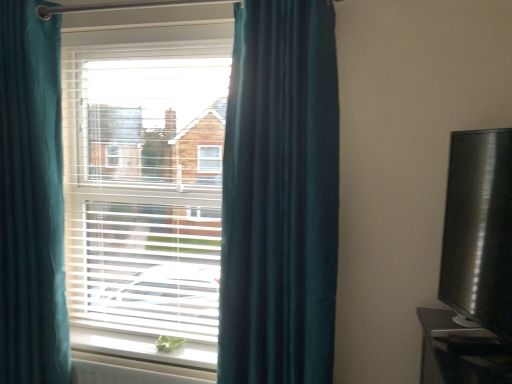
Describe the element at coordinates (143, 348) in the screenshot. I see `white matte window sill at lower center` at that location.

Measure the distance between point (249, 99) and camera.

Point (249, 99) is 4.84 feet from camera.

Locate an element on the screen. white plastic radiator at lower center is located at coordinates (133, 372).

The image size is (512, 384). In order to click on white plastic blinds at center in this screenshot , I will do `click(145, 190)`.

In order to click on white matte window sill at lower center in this screenshot , I will do `click(143, 348)`.

From a real-world perspective, between teal fabric curtain at left, the second curtain from the right, and white plastic radiator at lower center, who is vertically lower?

From a 3D spatial view, white plastic radiator at lower center is below.

From a real-world perspective, count 1st curtains upward from the white plastic radiator at lower center and point to it. Please provide its 2D coordinates.

[(31, 199)]

Are teal fabric curtain at left, acting as the 1th curtain starting from the left, and white plastic radiator at lower center located far from each other?

teal fabric curtain at left, acting as the 1th curtain starting from the left, is actually quite close to white plastic radiator at lower center.

At what (x,y) coordinates should I click in order to perform the action: click on bay window on the left of teal velvet curtain at left, which is the 2th curtain in left-to-right order. Please return your answer as a coordinate pair (x, y). The image size is (512, 384). Looking at the image, I should click on (145, 190).

Considering the sizes of objects teal velvet curtain at left, which is the 2th curtain in left-to-right order, and white plastic blinds at center in the image provided, who is wider, teal velvet curtain at left, which is the 2th curtain in left-to-right order, or white plastic blinds at center?

Wider between the two is teal velvet curtain at left, which is the 2th curtain in left-to-right order.

Relative to white plastic blinds at center, is teal velvet curtain at left, which is the 2th curtain in left-to-right order, in front or behind?

teal velvet curtain at left, which is the 2th curtain in left-to-right order, is in front of white plastic blinds at center.

Does white matte window sill at lower center have a larger size compared to teal velvet curtain at left, which is the 2th curtain in left-to-right order?

No.

In the image, there is a teal velvet curtain at left, which is the 2th curtain in left-to-right order. Identify the location of window sill below it (from the image's perspective). The width and height of the screenshot is (512, 384). (143, 348).

From the image's perspective, is white matte window sill at lower center below teal velvet curtain at left, the first curtain positioned from the right?

Yes.

From the picture: Can we say white matte window sill at lower center lies outside teal velvet curtain at left, which is the 2th curtain in left-to-right order?

Absolutely, white matte window sill at lower center is external to teal velvet curtain at left, which is the 2th curtain in left-to-right order.

How different are the orientations of white plastic radiator at lower center and white plastic blinds at center in degrees?

The facing directions of white plastic radiator at lower center and white plastic blinds at center are 0.00585 degrees apart.

Which object is more forward, white plastic radiator at lower center or white plastic blinds at center?

white plastic radiator at lower center is closer to the camera.

Is white plastic radiator at lower center with white plastic blinds at center?

white plastic radiator at lower center and white plastic blinds at center are clearly separated.

Between point (72, 365) and point (80, 157), which one is positioned behind?

The point (80, 157) is farther.

Between white plastic radiator at lower center and black glossy tv at right, which one has smaller width?

Thinner between the two is white plastic radiator at lower center.

Can you tell me how much white plastic radiator at lower center and black glossy tv at right differ in facing direction?

66.6 degrees separate the facing orientations of white plastic radiator at lower center and black glossy tv at right.

Does white plastic radiator at lower center turn towards black glossy tv at right?

No, white plastic radiator at lower center is not turned towards black glossy tv at right.

Which is closer to the camera, (74,373) or (509,162)?

Point (74,373) appears to be farther away from the viewer than point (509,162).

Looking at this image, is black glossy tv at right positioned with its back to white plastic blinds at center?

No, black glossy tv at right is not facing the opposite direction of white plastic blinds at center.

Between black glossy tv at right and white plastic blinds at center, which one has smaller size?

Smaller between the two is black glossy tv at right.

Is black glossy tv at right closer to camera compared to white plastic blinds at center?

Yes.

Is white plastic blinds at center at the back of teal fabric curtain at left, the second curtain from the right?

Correct, teal fabric curtain at left, the second curtain from the right, is looking away from white plastic blinds at center.

Can you confirm if teal fabric curtain at left, the second curtain from the right, is bigger than white plastic blinds at center?

Correct, teal fabric curtain at left, the second curtain from the right, is larger in size than white plastic blinds at center.

Which is less distant, (1, 76) or (214, 249)?

Point (1, 76) is positioned closer to the camera compared to point (214, 249).

What are the coordinates of `radiator behind the teal fabric curtain at left, acting as the 1th curtain starting from the left` in the screenshot? It's located at (133, 372).

Where is `the 1st curtain below when counting from the white plastic blinds at center (from the image's perspective)`? the 1st curtain below when counting from the white plastic blinds at center (from the image's perspective) is located at coordinates (280, 196).

Looking at the image, which one is located closer to teal fabric curtain at left, acting as the 1th curtain starting from the left, black glossy tv at right or teal velvet curtain at left, the first curtain positioned from the right?

teal velvet curtain at left, the first curtain positioned from the right, is positioned closer to the anchor teal fabric curtain at left, acting as the 1th curtain starting from the left.

Looking at the image, which one is located further to white plastic blinds at center, white matte window sill at lower center or black glossy tv at right?

black glossy tv at right.

From the image, which object appears to be farther from white matte window sill at lower center, black glossy tv at right or teal velvet curtain at left, which is the 2th curtain in left-to-right order?

Based on the image, black glossy tv at right appears to be further to white matte window sill at lower center.

When comparing their distances from white plastic blinds at center, does white matte window sill at lower center or teal fabric curtain at left, the second curtain from the right, seem closer?

teal fabric curtain at left, the second curtain from the right, lies closer to white plastic blinds at center than the other object.

Looking at the image, which one is located closer to white plastic blinds at center, white plastic radiator at lower center or white matte window sill at lower center?

white matte window sill at lower center.

Considering their positions, is white matte window sill at lower center positioned further to white plastic radiator at lower center than black glossy tv at right?

The object further to white plastic radiator at lower center is black glossy tv at right.

Which object lies further to the anchor point teal velvet curtain at left, the first curtain positioned from the right, white matte window sill at lower center or teal fabric curtain at left, acting as the 1th curtain starting from the left?

teal fabric curtain at left, acting as the 1th curtain starting from the left, is further to teal velvet curtain at left, the first curtain positioned from the right.

Which object lies further to the anchor point black glossy tv at right, white plastic radiator at lower center or teal velvet curtain at left, which is the 2th curtain in left-to-right order?

The object further to black glossy tv at right is white plastic radiator at lower center.

In order to click on window sill between teal velvet curtain at left, which is the 2th curtain in left-to-right order, and white plastic radiator at lower center vertically in this screenshot , I will do `click(143, 348)`.

Find the location of a particular element. radiator located between white matte window sill at lower center and black glossy tv at right in the left-right direction is located at coordinates (133, 372).

Locate an element on the screen. The height and width of the screenshot is (384, 512). window sill between teal fabric curtain at left, acting as the 1th curtain starting from the left, and teal velvet curtain at left, which is the 2th curtain in left-to-right order, from left to right is located at coordinates (143, 348).

This screenshot has width=512, height=384. I want to click on window sill between teal fabric curtain at left, the second curtain from the right, and black glossy tv at right, in the horizontal direction, so click(143, 348).